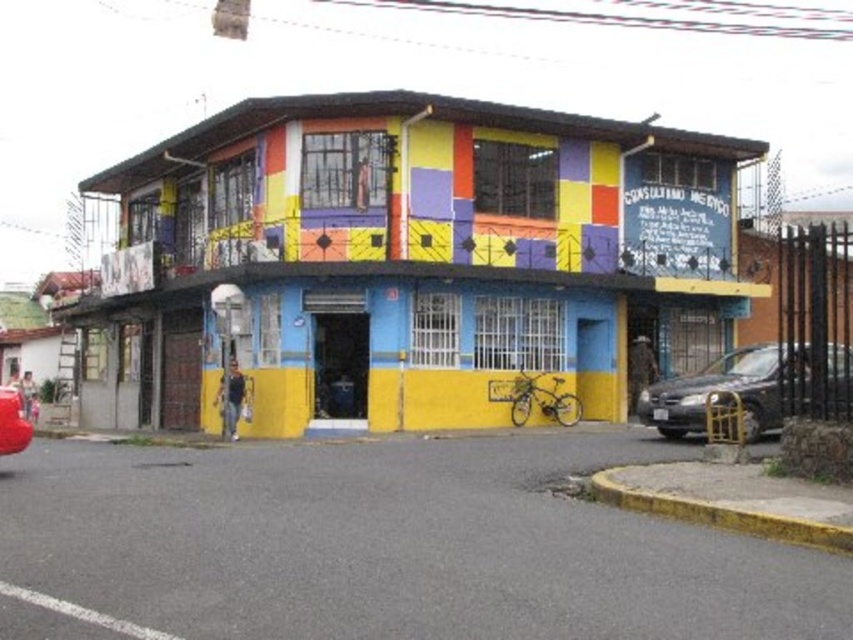
You are standing at the entrance of the two story building and want to park your car. The parking lot is located at coordinate point 0.611, 0.858. Is the dark gray metallic car at lower right blocking the parking spot?

The dark gray metallic car at lower right is located at coordinate point (730, 390), so yes, it is blocking the parking spot at that coordinate.

You are standing in front of the two story building. You see the point at coordinates (730, 390). What object is this point located on?

The point at coordinates (730, 390) is located on the dark gray metallic car at lower right.